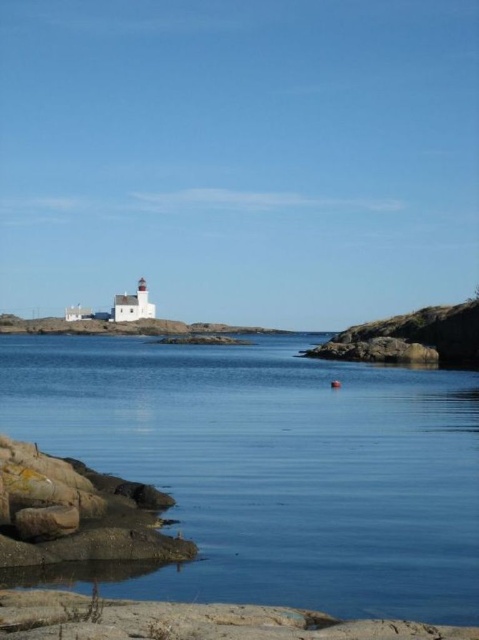
Which of these two, blue smooth water at center or rusty stone rocks at lower left, stands shorter?

Standing shorter between the two is rusty stone rocks at lower left.

From the picture: Can you confirm if blue smooth water at center is positioned to the right of rusty stone rocks at lower left?

Correct, you'll find blue smooth water at center to the right of rusty stone rocks at lower left.

Does point (334, 436) come farther from viewer compared to point (23, 556)?

Yes, point (334, 436) is behind point (23, 556).

Where is `blue smooth water at center`? Image resolution: width=479 pixels, height=640 pixels. blue smooth water at center is located at coordinates (272, 467).